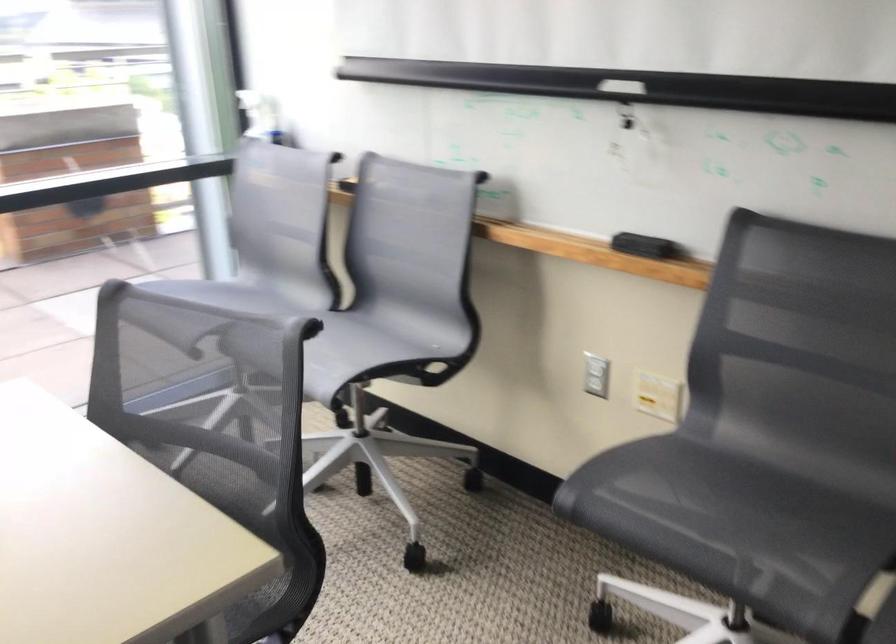
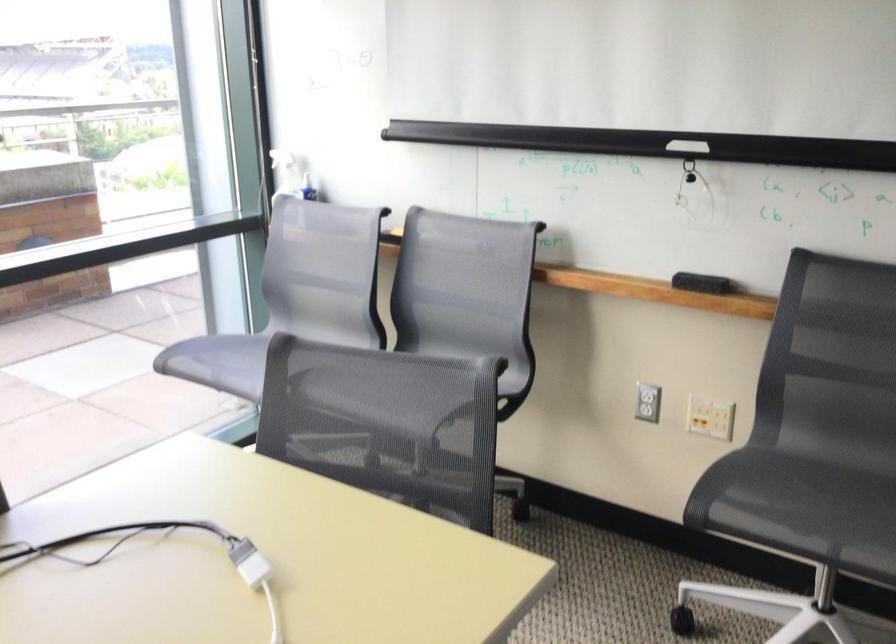
Where in the second image is the point corresponding to [631,88] from the first image?

(687, 146)